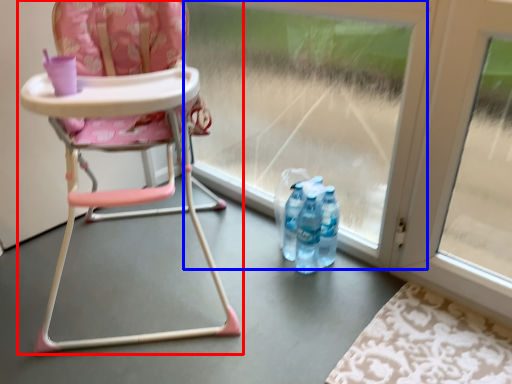
Question: Which point is closer to the camera, chair (highlighted by a red box) or glass door (highlighted by a blue box)?

Choices:
 (A) chair
 (B) glass door

Answer: (A)